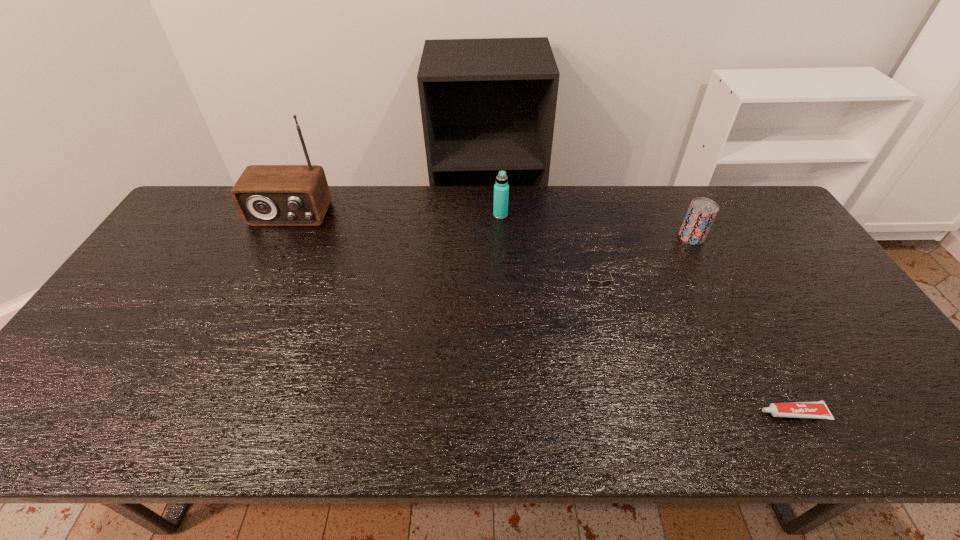
In order to click on vacant area located 0.290m on the right of the second object from left to right in this screenshot , I will do pyautogui.click(x=594, y=215).

Where is `vacant region located on the front of the beer can`? vacant region located on the front of the beer can is located at coordinates (729, 310).

The width and height of the screenshot is (960, 540). In order to click on free space located 0.280m in front of the lenses of the second nearest object in this screenshot , I will do point(619,389).

The height and width of the screenshot is (540, 960). What are the coordinates of `vacant space positioned 0.050m at the nozzle of the toothpaste` in the screenshot? It's located at (738, 413).

Find the location of a particular element. vacant space located 0.310m at the nozzle of the toothpaste is located at coordinates (621, 413).

This screenshot has height=540, width=960. I want to click on free space located 0.230m at the nozzle of the toothpaste, so click(x=657, y=413).

The width and height of the screenshot is (960, 540). I want to click on radio receiver that is at the far edge, so click(x=265, y=195).

At what (x,y) coordinates should I click in order to perform the action: click on water bottle present at the far edge. Please return your answer as a coordinate pair (x, y). Looking at the image, I should click on (501, 189).

Where is `beer can located at the far edge`? The height and width of the screenshot is (540, 960). beer can located at the far edge is located at coordinates (701, 213).

Find the location of `object that is at the near edge`. object that is at the near edge is located at coordinates (817, 409).